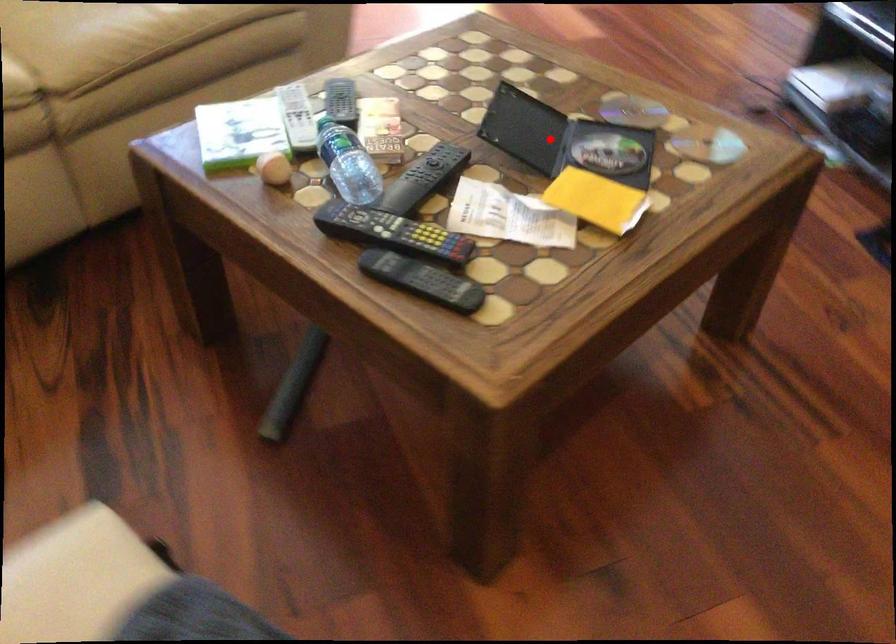
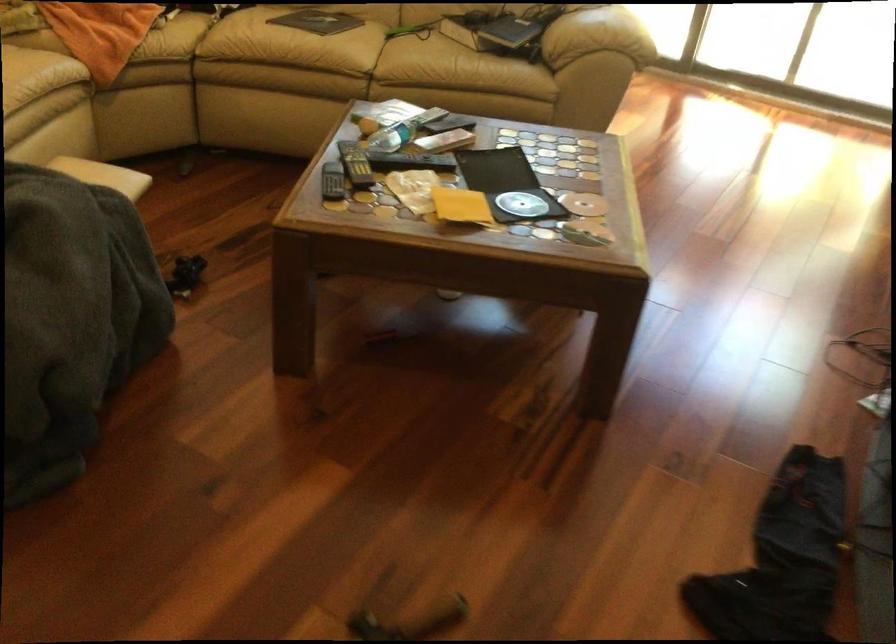
Find the pixel in the second image that matches the highlighted location in the first image.

(506, 184)